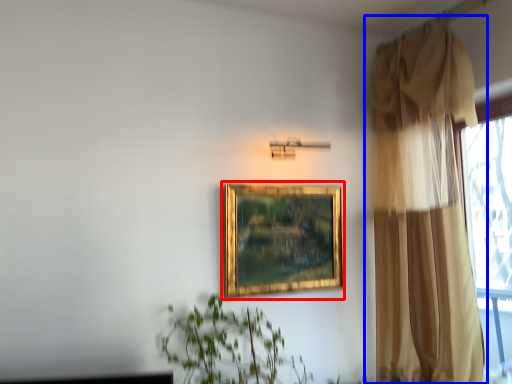
Question: Among these objects, which one is farthest to the camera, picture frame (highlighted by a red box) or curtain (highlighted by a blue box)?

Choices:
 (A) picture frame
 (B) curtain

Answer: (A)